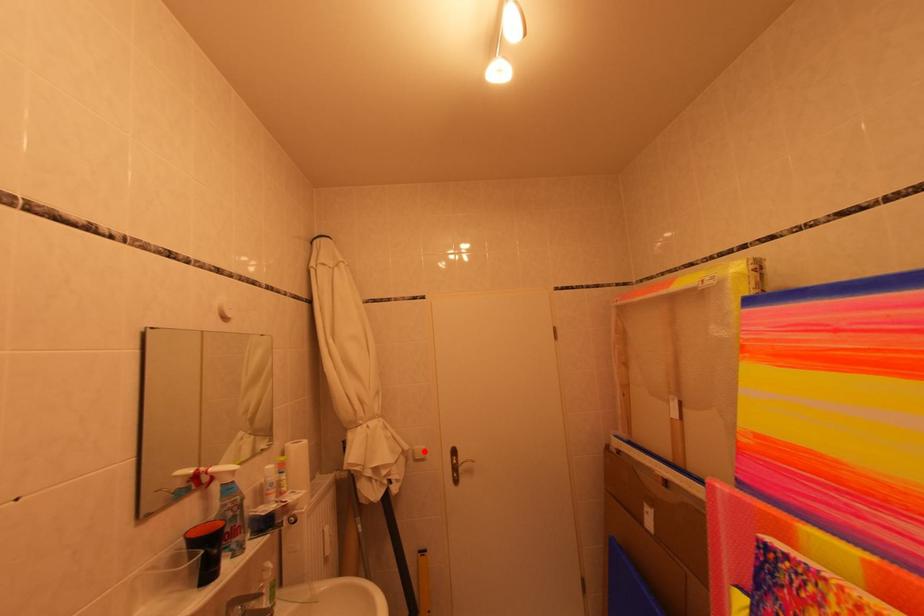
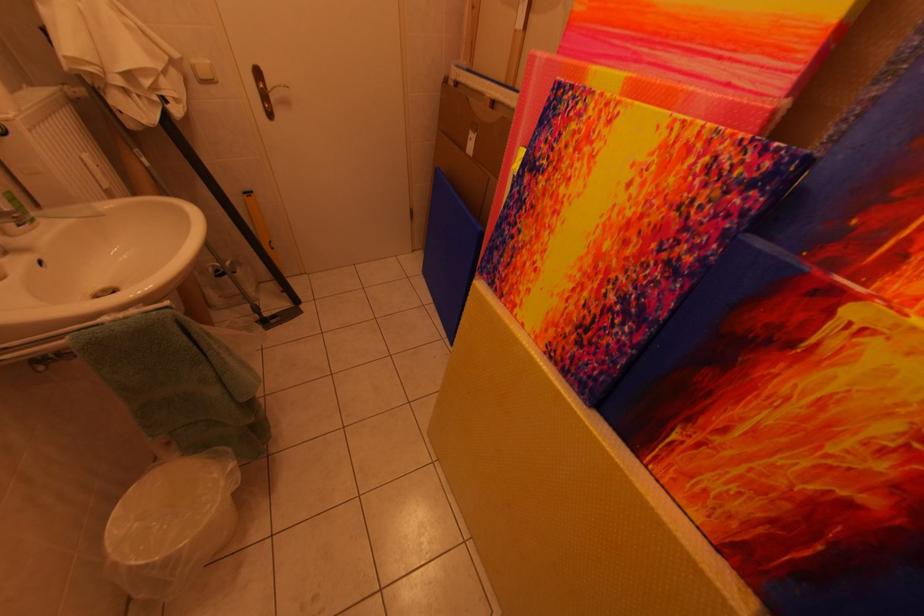
In the second image, find the point that corresponds to the highlighted location in the first image.

(203, 65)